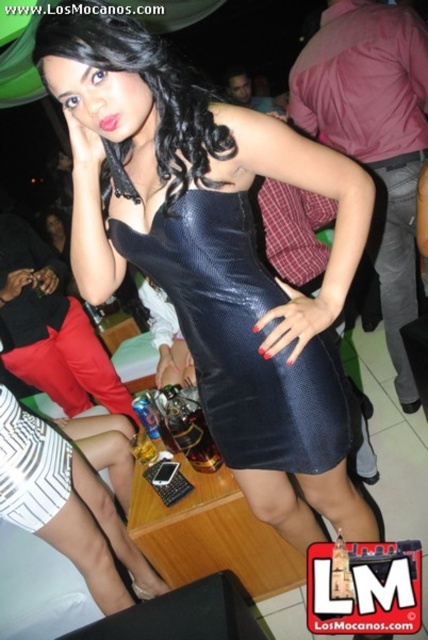
You are a photographer at the party and want to capture a photo that includes both the black leather dress at center and the black leather pants at right. The minimum distance your camera can focus on two objects is 3 feet. Will both items be in focus?

The black leather dress at center is 3.81 feet away from black leather pants at right. Since 3.81 feet is greater than the minimum focus distance of 3 feet, both items will be in focus.

You are at a party and want to take a photo of the two points in the image. The first point is at coordinates point [231,212] and the second point is at point [413,397]. Which point should you focus on first to ensure both are in the frame?

You should focus on point [231,212] first because it is closer to the viewer than point [413,397], ensuring both points remain in the frame.